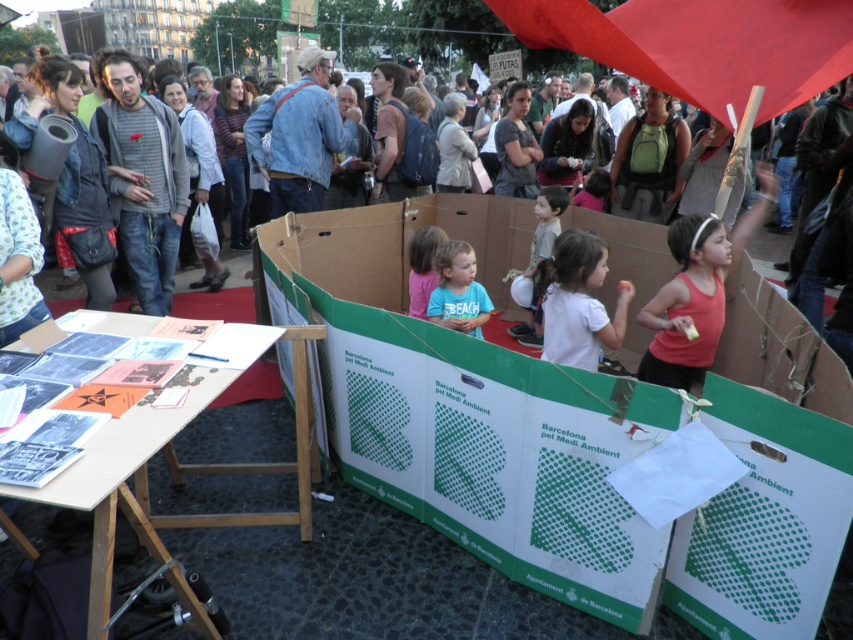
Question: Among these points, which one is farthest from the camera?

Choices:
 (A) (438, 268)
 (B) (564, 352)
 (C) (148, 518)

Answer: (A)

Question: Which of these objects is positioned closest to the matte cardboard box at center?

Choices:
 (A) green cardboard box at center
 (B) white matte shirt at center
 (C) wooden table at lower left

Answer: (C)

Question: Is wooden table at lower left below blue cotton shirt at center?

Choices:
 (A) yes
 (B) no

Answer: (A)

Question: Which object is the closest to the white matte shirt at center?

Choices:
 (A) green cardboard box at center
 (B) matte cardboard box at center
 (C) pink fabric shirt at center

Answer: (C)

Question: Can you confirm if blue cotton shirt at center is smaller than matte cardboard box at center?

Choices:
 (A) no
 (B) yes

Answer: (B)

Question: Can you confirm if wooden table at lower left is positioned to the right of matte cardboard box at center?

Choices:
 (A) no
 (B) yes

Answer: (B)